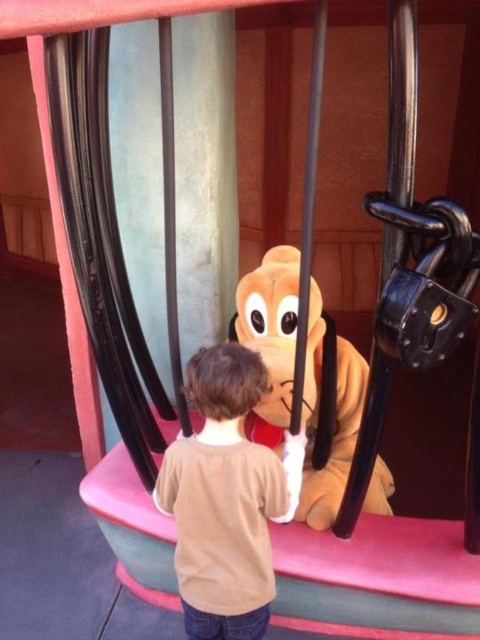
You are a photographer trying to capture a photo of the fuzzy yellow dog at center. You notice the brown cotton shirt at center is blocking your view. Can you move the shirt to get a clear shot of the dog?

The brown cotton shirt at center is closer to the viewer than the fuzzy yellow dog at center, so moving the shirt would allow you to see the dog clearly.

You are a photographer trying to capture a photo of the brown cotton shirt at center and the fuzzy yellow dog at center. Which object takes up more area in the photo?

The fuzzy yellow dog at center takes up more area in the photo because the brown cotton shirt at center occupies less space than the fuzzy yellow dog at center.

You are a photographer trying to capture a photo of the brown cotton shirt at center and the fuzzy yellow dog at center. Based on their heights, which object should you focus on first if you want to ensure both are in frame without cropping?

The brown cotton shirt at center has a lesser height compared to the fuzzy yellow dog at center, so you should focus on the fuzzy yellow dog at center first to ensure it fits within the frame while still capturing the brown cotton shirt at center.